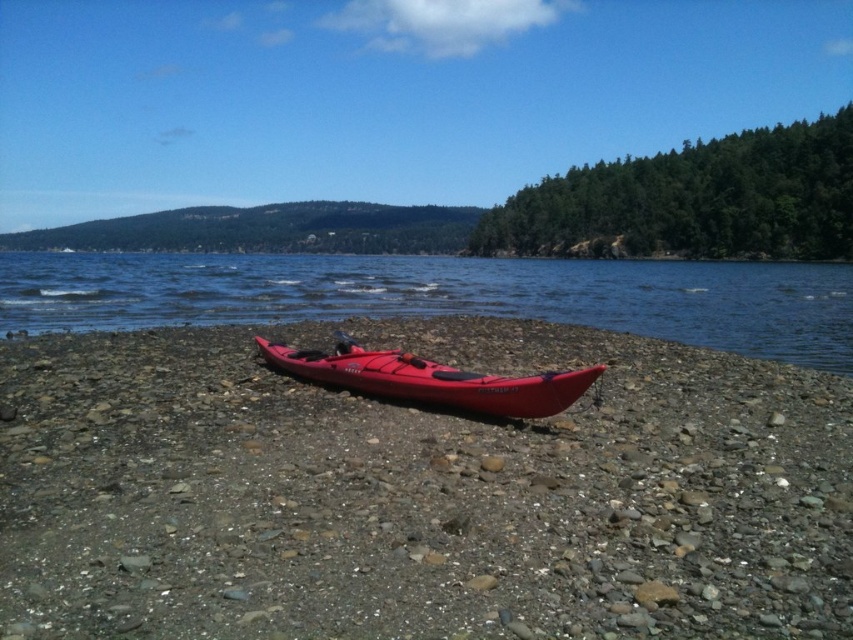
You are planning to take a water tour on the lake. You see two vessels available for use, the matte plastic kayak at center and the matte red canoe at center. Which vessel would be more spacious for carrying more gear?

The matte plastic kayak at center is bigger than the matte red canoe at center, so it would be more spacious for carrying more gear.

You are planning to take a photo of the matte red canoe at center and transparent water at center from the shore. Which object will appear closer to the camera in the photo?

The transparent water at center will appear closer to the camera in the photo because the matte red canoe at center is behind it.

You are standing on the rocky shoreline and want to reach the transparent water at center. Which direction should you walk to get there?

To reach the transparent water at center from the rocky shoreline, you should walk towards the center of the image, as the transparent water at center is located at point [444,296] in the frame.